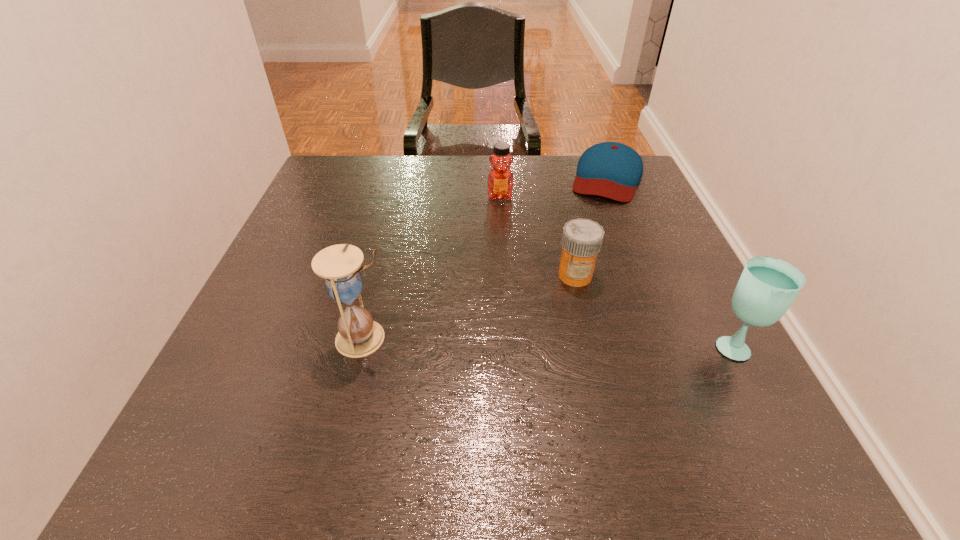
Find the location of a particular element. blank space located on the label side of the third object from right to left is located at coordinates (554, 300).

The image size is (960, 540). I want to click on vacant space located 0.210m on the label side of the third object from right to left, so click(x=510, y=351).

At what (x,y) coordinates should I click in order to perform the action: click on vacant space located 0.330m on the label side of the third object from right to left. Please return your answer as a coordinate pair (x, y). Image resolution: width=960 pixels, height=540 pixels. Looking at the image, I should click on (469, 397).

Locate an element on the screen. This screenshot has height=540, width=960. free location located 0.250m on the front label of the second object from left to right is located at coordinates (502, 268).

At what (x,y) coordinates should I click in order to perform the action: click on vacant space situated on the front label of the second object from left to right. Please return your answer as a coordinate pair (x, y). Looking at the image, I should click on (503, 297).

The width and height of the screenshot is (960, 540). Identify the location of vacant space located 0.230m on the front label of the second object from left to right. (502, 261).

Image resolution: width=960 pixels, height=540 pixels. In order to click on blank space located with the bill of the shortest object facing forward in this screenshot , I will do `click(582, 264)`.

The image size is (960, 540). I want to click on free space located 0.070m with the bill of the shortest object facing forward, so click(x=597, y=217).

Image resolution: width=960 pixels, height=540 pixels. Identify the location of free space located with the bill of the shortest object facing forward. (570, 300).

This screenshot has width=960, height=540. Identify the location of honey present at the far edge. (500, 181).